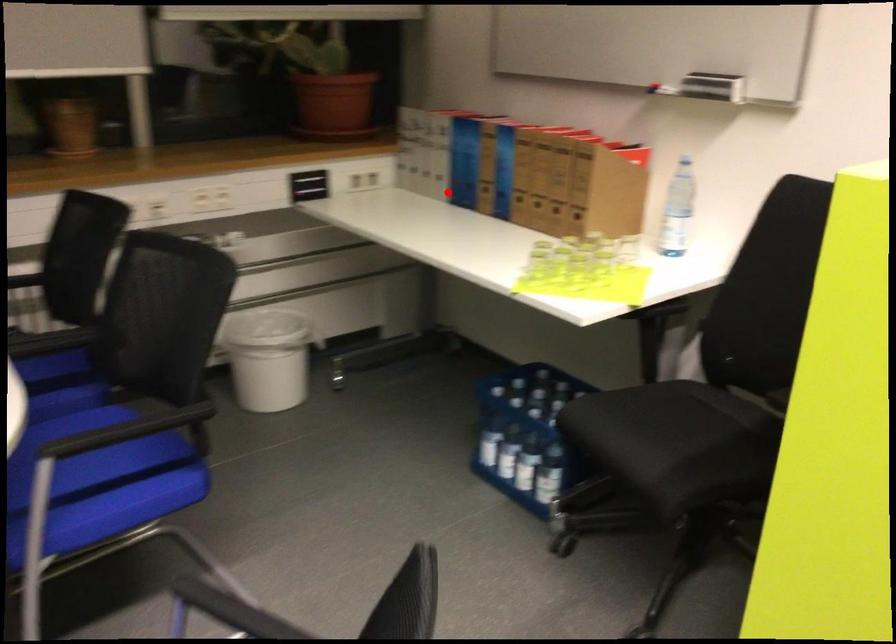
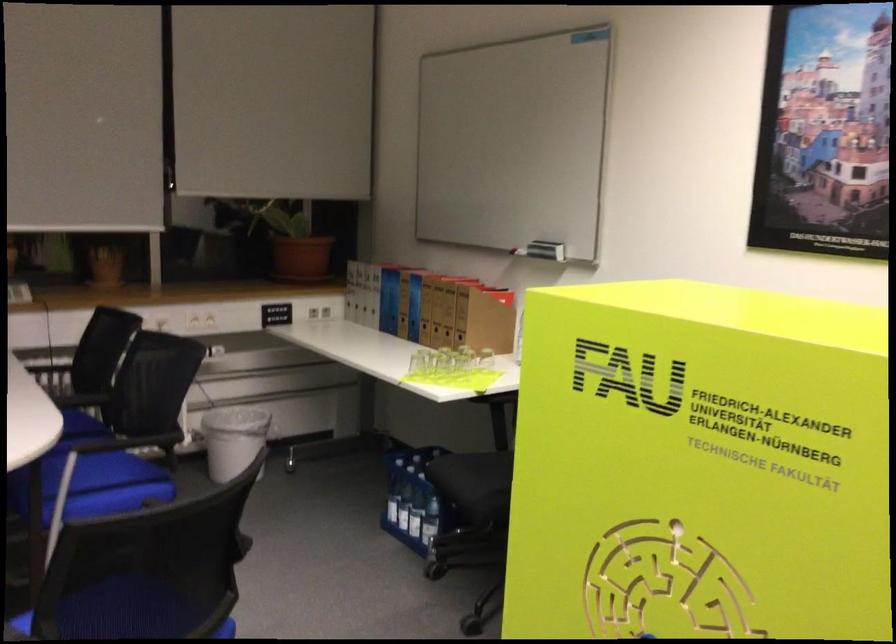
In the second image, find the point that corresponds to the highlighted location in the first image.

(382, 321)